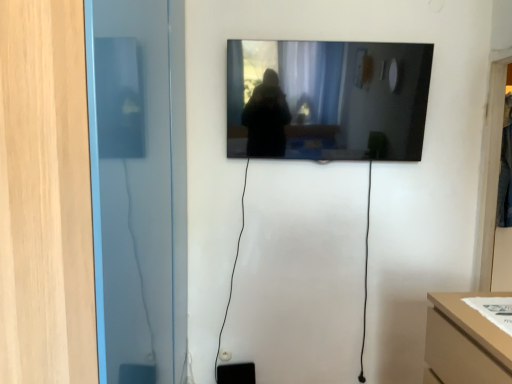
Question: From the image's perspective, is transparent glass door at left, positioned as the 1th glass door in front-to-back order, above or below transparent glass door at right, the 2th glass door viewed from the left?

Choices:
 (A) below
 (B) above

Answer: (A)

Question: From a real-world perspective, relative to transparent glass door at right, marked as the 1th glass door in a right-to-left arrangement, is transparent glass door at left, which is the first glass door in left-to-right order, vertically above or below?

Choices:
 (A) below
 (B) above

Answer: (A)

Question: Estimate the real-world distances between objects in this image. Which object is closer to the black glossy mirror at upper center?

Choices:
 (A) transparent glass door at left, which is the first glass door in left-to-right order
 (B) transparent glass door at right, which is counted as the second glass door, starting from the front

Answer: (B)

Question: Which is nearer to the transparent glass door at right, marked as the 1th glass door in a right-to-left arrangement?

Choices:
 (A) transparent glass door at left, which is the first glass door in left-to-right order
 (B) black glossy mirror at upper center

Answer: (B)